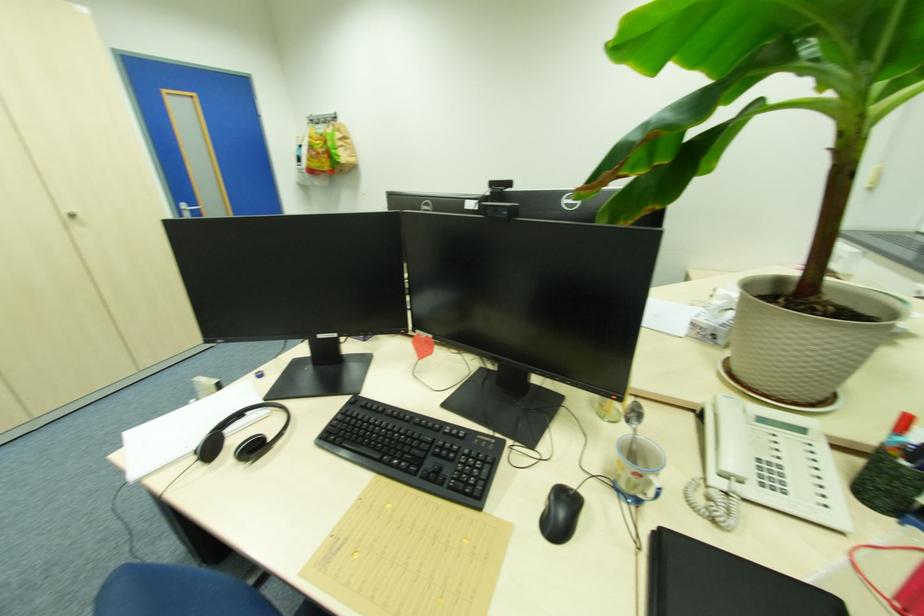
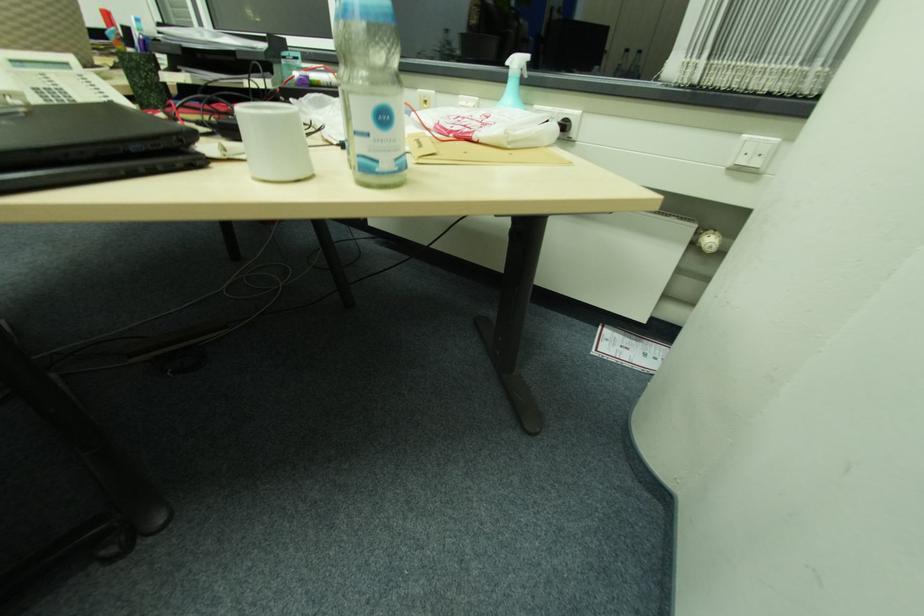
How did the camera likely rotate?

The camera's rotation is toward right-down.